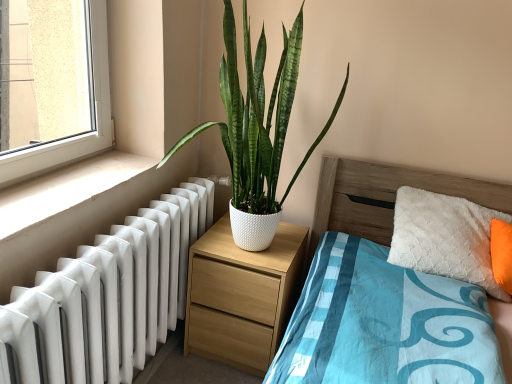
Question: Is white textured pot at center bigger or smaller than light wood/texture nightstand at center?

Choices:
 (A) big
 (B) small

Answer: (A)

Question: From a real-world perspective, is white textured pot at center positioned above or below light wood/texture nightstand at center?

Choices:
 (A) below
 (B) above

Answer: (B)

Question: Estimate the real-world distances between objects in this image. Which object is closer to the white textured pot at center?

Choices:
 (A) wooden bed at center
 (B) white smooth window sill at lower left
 (C) white glossy radiator at left
 (D) light wood/texture nightstand at center

Answer: (D)

Question: Which of these objects is positioned farthest from the white glossy radiator at left?

Choices:
 (A) white smooth window sill at lower left
 (B) light wood/texture nightstand at center
 (C) white textured pot at center
 (D) wooden bed at center

Answer: (D)